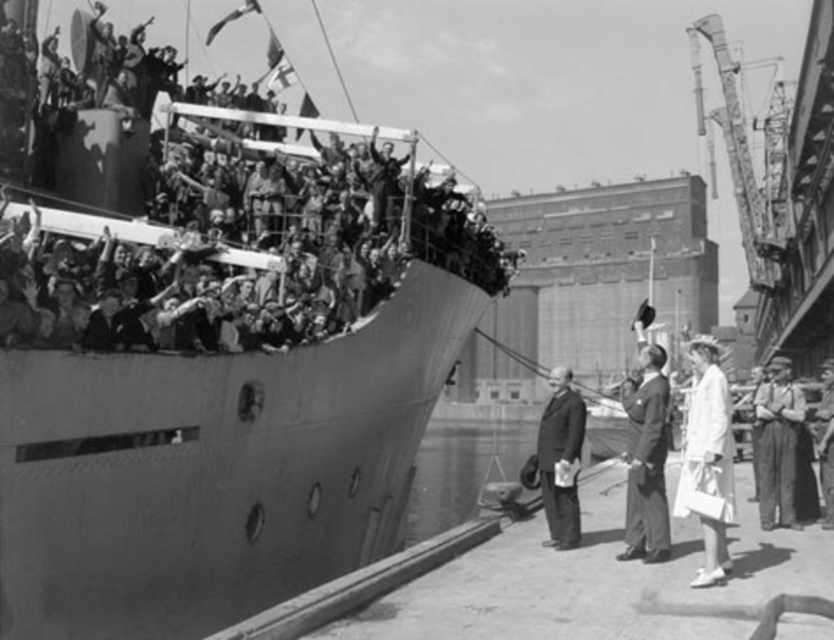
Looking at this image, can you confirm if smooth gray ship at upper left is smaller than denim pants at lower right?

No.

Describe the element at coordinates (217, 360) in the screenshot. I see `smooth gray ship at upper left` at that location.

What are the coordinates of `smooth gray ship at upper left` in the screenshot? It's located at (217, 360).

You are a GUI agent. You are given a task and a screenshot of the screen. Output one action in this format:
    pyautogui.click(x=<x>, y=<y>)
    Task: Click on the smooth gray ship at upper left
    The width and height of the screenshot is (834, 640).
    Given the screenshot: What is the action you would take?
    pyautogui.click(x=217, y=360)

Is point (699, 436) closer to viewer compared to point (775, 438)?

Yes, point (699, 436) is closer to viewer.

Which is below, white fabric dress at lower right or denim pants at lower right?

Positioned lower is denim pants at lower right.

Between point (711, 484) and point (792, 509), which one is positioned behind?

Point (792, 509)

The image size is (834, 640). What are the coordinates of `white fabric dress at lower right` in the screenshot? It's located at (707, 460).

Consider the image. Is smooth gray ship at upper left bigger than white fabric dress at lower right?

Indeed, smooth gray ship at upper left has a larger size compared to white fabric dress at lower right.

Is smooth gray ship at upper left taller than white fabric dress at lower right?

Yes.

Who is more distant from viewer, (163,154) or (727,419)?

Point (163,154)

The height and width of the screenshot is (640, 834). I want to click on smooth gray ship at upper left, so click(x=217, y=360).